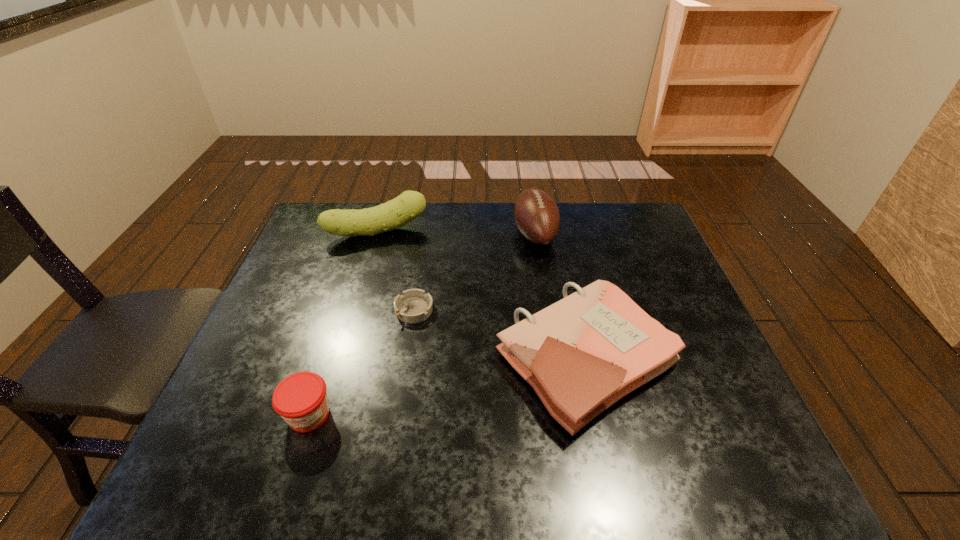
Find the location of `vacant space at the far left corner`. vacant space at the far left corner is located at coordinates (340, 236).

Find the location of a particular element. The height and width of the screenshot is (540, 960). blank area at the far right corner is located at coordinates (611, 240).

In order to click on free space between the football (American) and the phonebook in this screenshot , I will do `click(561, 296)`.

Image resolution: width=960 pixels, height=540 pixels. In order to click on free area in between the cucumber and the jam in this screenshot , I will do `click(343, 323)`.

This screenshot has height=540, width=960. Find the location of `vacant area that lies between the jam and the football (American)`. vacant area that lies between the jam and the football (American) is located at coordinates (421, 324).

The height and width of the screenshot is (540, 960). In order to click on vacant area that lies between the football (American) and the cucumber in this screenshot , I will do `click(456, 233)`.

The height and width of the screenshot is (540, 960). What are the coordinates of `free space between the cucumber and the jam` in the screenshot? It's located at (343, 323).

Where is `empty location between the cucumber and the football (American)`? The height and width of the screenshot is (540, 960). empty location between the cucumber and the football (American) is located at coordinates (456, 233).

In order to click on free point between the jam and the phonebook in this screenshot , I will do `click(447, 387)`.

The height and width of the screenshot is (540, 960). I want to click on free space between the phonebook and the cucumber, so (x=481, y=295).